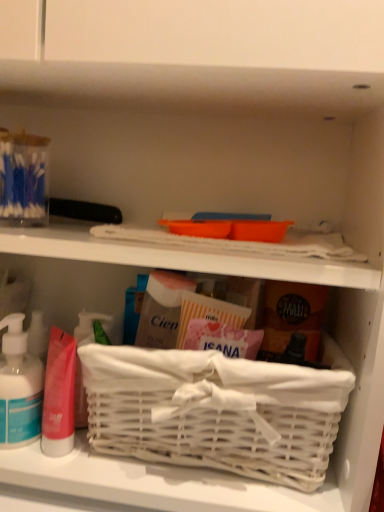
Question: Based on their sizes in the image, would you say white wicker basket at center is bigger or smaller than translucent plastic pump bottle at lower left?

Choices:
 (A) big
 (B) small

Answer: (A)

Question: Is white wicker basket at center inside the boundaries of translucent plastic pump bottle at lower left, or outside?

Choices:
 (A) inside
 (B) outside

Answer: (B)

Question: Based on their positions, is white wicker basket at center located to the left or right of translucent plastic pump bottle at lower left?

Choices:
 (A) right
 (B) left

Answer: (A)

Question: Which is correct: translucent plastic pump bottle at lower left is inside white wicker basket at center, or outside of it?

Choices:
 (A) inside
 (B) outside

Answer: (B)

Question: From their relative heights in the image, would you say translucent plastic pump bottle at lower left is taller or shorter than white wicker basket at center?

Choices:
 (A) tall
 (B) short

Answer: (B)

Question: In the image, is translucent plastic pump bottle at lower left on the left side or the right side of white wicker basket at center?

Choices:
 (A) left
 (B) right

Answer: (A)

Question: Relative to white wicker basket at center, is translucent plastic pump bottle at lower left in front or behind?

Choices:
 (A) behind
 (B) front

Answer: (A)